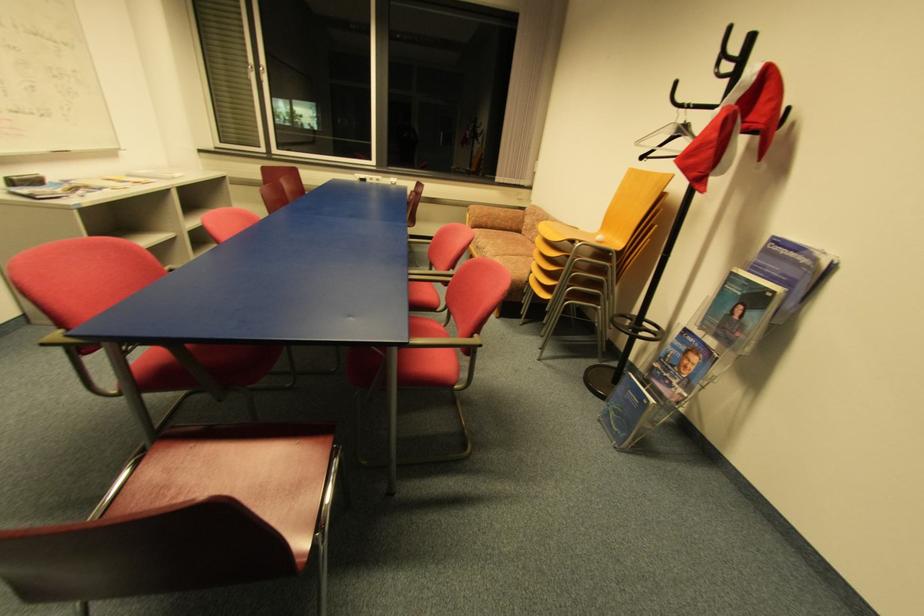
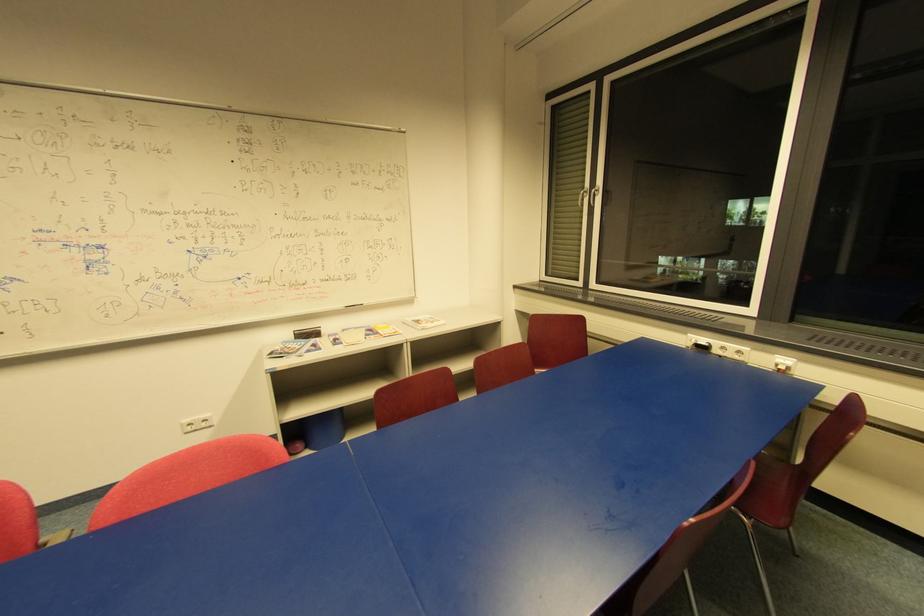
Find the pixel in the second image that matches (266,70) in the first image.

(598, 192)